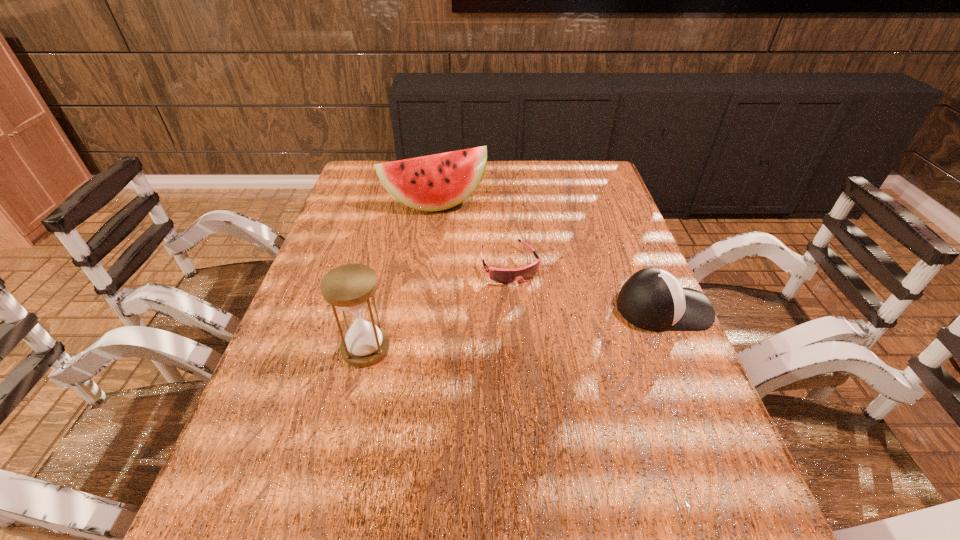
Locate an element on the screen. vacant space on the desktop that is between the hourglass and the third tallest object and is positioned on the outer rind of the watermelon is located at coordinates (482, 333).

Where is `vacant space on the desktop that is between the hourglass and the third tallest object and is positioned on the front-facing side of the third nearest object`? vacant space on the desktop that is between the hourglass and the third tallest object and is positioned on the front-facing side of the third nearest object is located at coordinates (540, 325).